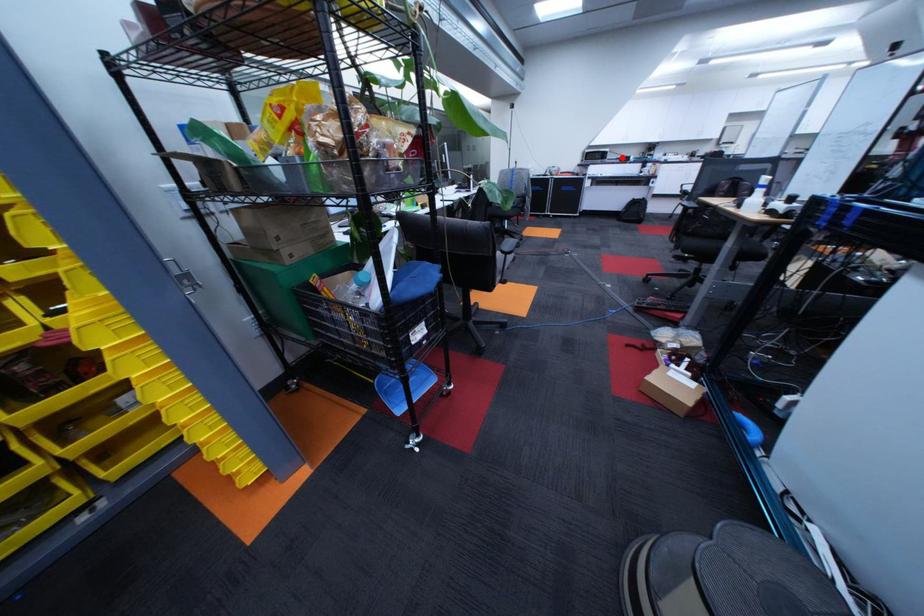
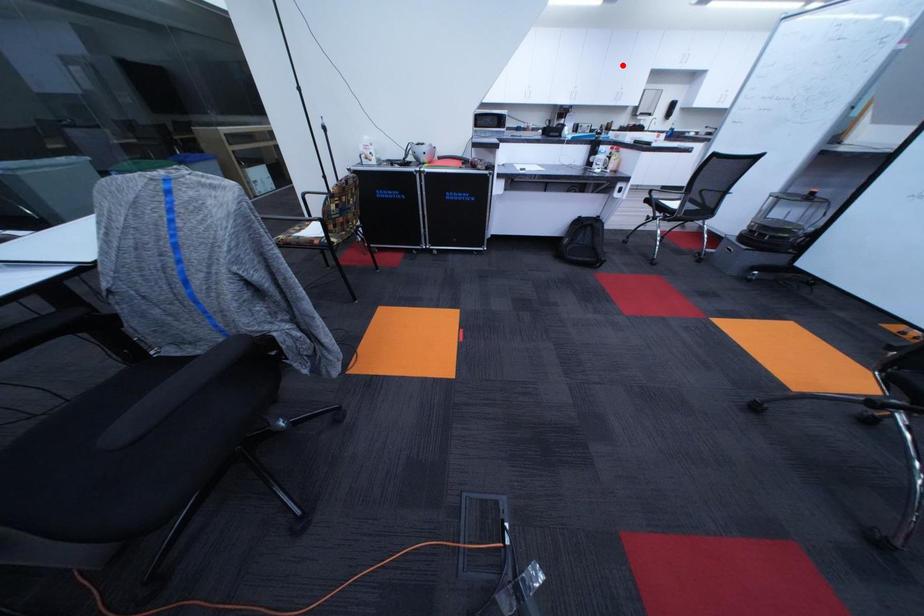
I am providing you with two images of the same scene from different viewpoints. A red point is marked on the first image and another point is marked on the second image. Does the point marked in image1 correspond to the same location as the one in image2?

No